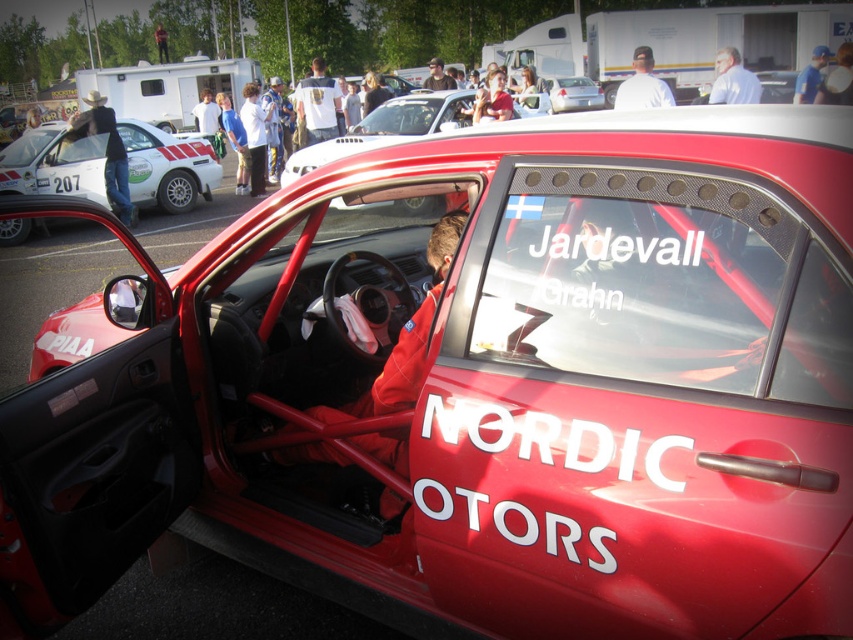
Which is below, white shirt at upper center or light blue shirt at upper right?

Positioned lower is white shirt at upper center.

Does point (633, 81) come farther from viewer compared to point (720, 74)?

No, (633, 81) is in front of (720, 74).

Which is in front, point (642, 65) or point (759, 92)?

Positioned in front is point (759, 92).

Locate an element on the screen. white shirt at upper center is located at coordinates (642, 84).

Is matte red car at center positioned at the back of matte black helmet at upper center?

That is False.

Describe the element at coordinates (387, 129) in the screenshot. The width and height of the screenshot is (853, 640). I see `matte red car at center` at that location.

Which is behind, point (535, 115) or point (439, 84)?

Point (439, 84)

The width and height of the screenshot is (853, 640). I want to click on matte red car at center, so click(387, 129).

Is matte red car at center to the left of white t-shirt at center from the viewer's perspective?

In fact, matte red car at center is to the right of white t-shirt at center.

From the picture: Measure the distance between matte red car at center and white t-shirt at center.

matte red car at center and white t-shirt at center are 20.70 feet apart from each other.

Find the location of a particular element. This screenshot has height=640, width=853. matte red car at center is located at coordinates (387, 129).